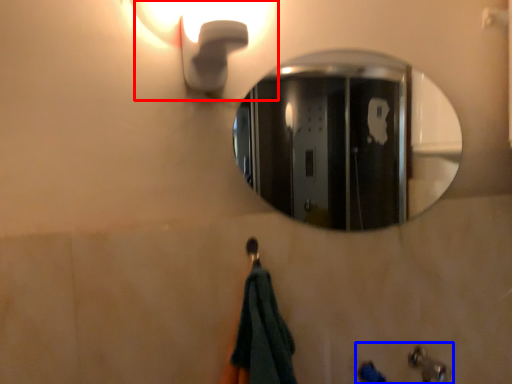
Question: Which object is closer to the camera taking this photo, light fixture (highlighted by a red box) or sink (highlighted by a blue box)?

Choices:
 (A) light fixture
 (B) sink

Answer: (A)